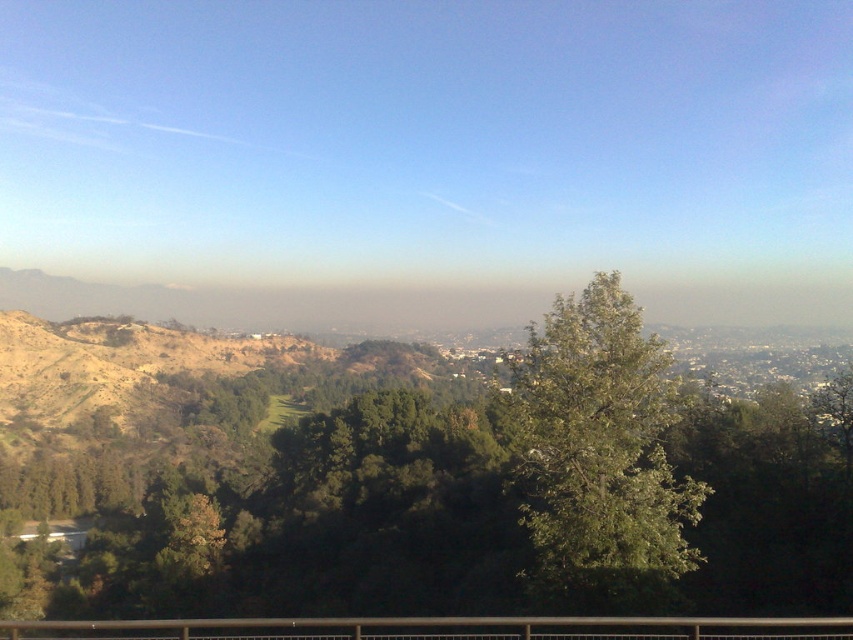
The image size is (853, 640). What do you see at coordinates (598, 456) in the screenshot?
I see `green leafy tree at center` at bounding box center [598, 456].

Who is lower down, green leafy tree at center or black metal rail at lower center?

black metal rail at lower center is below.

Is point (648, 378) closer to camera compared to point (277, 620)?

That is False.

At what (x,y) coordinates should I click in order to perform the action: click on green leafy tree at center. Please return your answer as a coordinate pair (x, y). The height and width of the screenshot is (640, 853). Looking at the image, I should click on (598, 456).